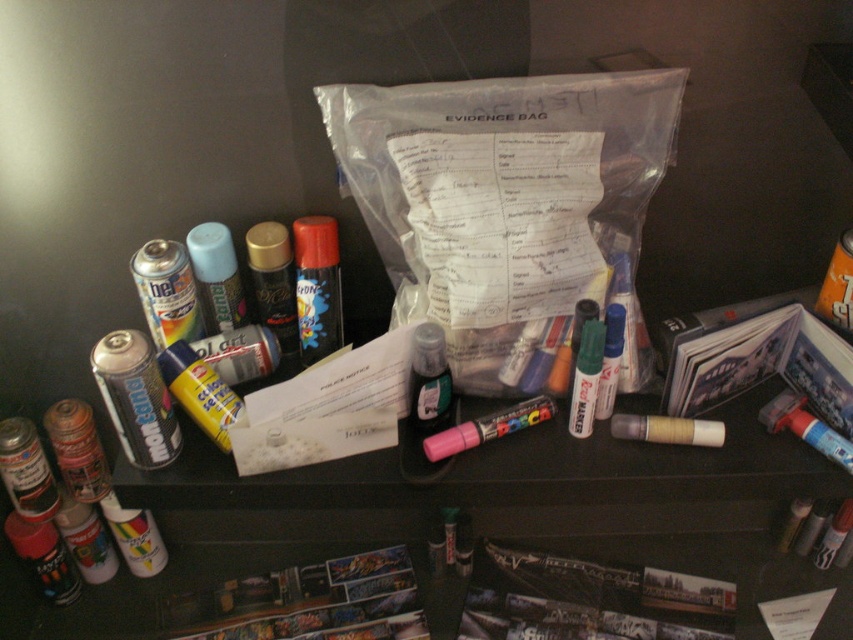
Is transparent plastic evidence bag at center shorter than pink matte marker at center?

Incorrect, transparent plastic evidence bag at center's height does not fall short of pink matte marker at center's.

Who is more distant from viewer, (521, 316) or (457, 429)?

Positioned behind is point (457, 429).

Identify the location of transparent plastic evidence bag at center. The height and width of the screenshot is (640, 853). (508, 204).